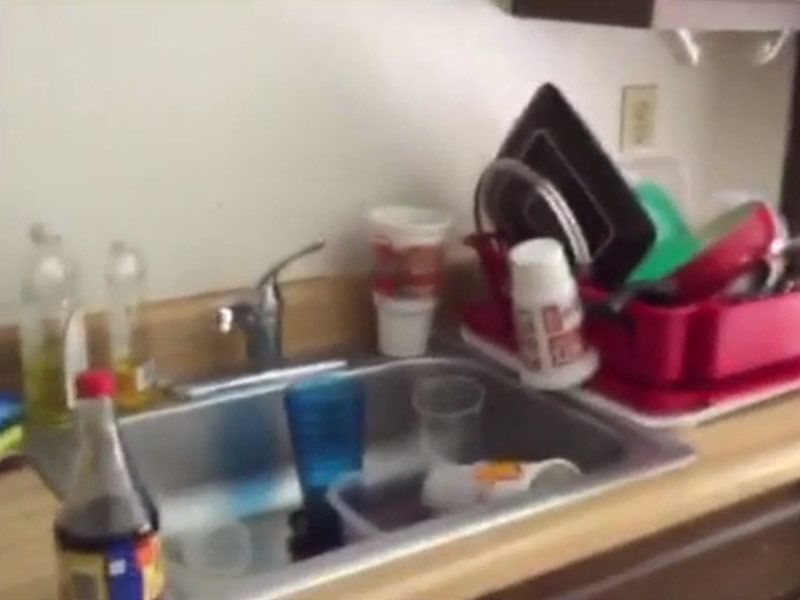
I want to click on wall, so click(x=198, y=118).